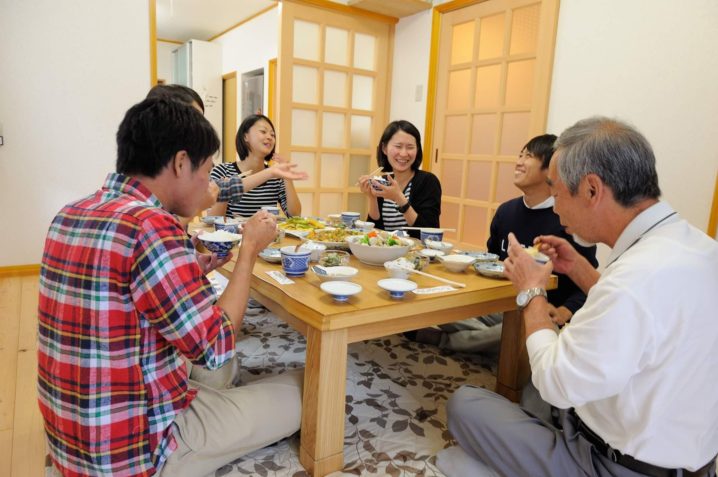
Locate an element on the screen. This screenshot has width=718, height=477. paned door is located at coordinates (335, 119), (498, 109).